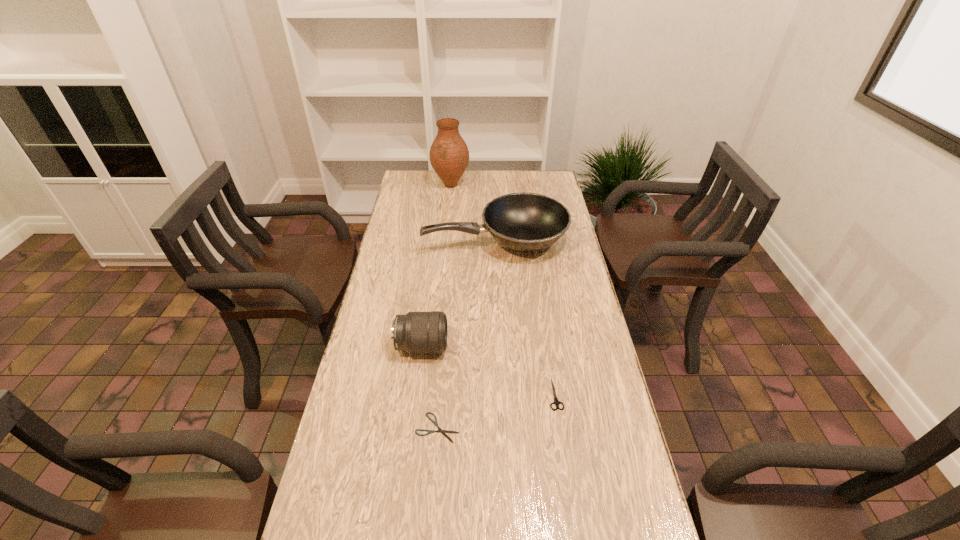
Where is `empty space that is in between the tallest object and the telephoto lens`? This screenshot has width=960, height=540. empty space that is in between the tallest object and the telephoto lens is located at coordinates (436, 266).

This screenshot has width=960, height=540. What are the coordinates of `free space between the frying pan and the shorter shears` in the screenshot? It's located at (467, 334).

Identify the location of free area in between the right shears and the fourth nearest object. (525, 318).

Where is `vacant point located between the fourth tallest object and the nearest object`? This screenshot has width=960, height=540. vacant point located between the fourth tallest object and the nearest object is located at coordinates (496, 411).

Locate an element on the screen. free point between the telephoto lens and the nearer shears is located at coordinates (430, 387).

Identify which object is the third nearest to the telephoto lens. Please provide its 2D coordinates. Your answer should be formatted as a tuple, i.e. [(x, y)], where the tuple contains the x and y coordinates of a point satisfying the conditions above.

[(526, 222)]

Choose which object is the second nearest neighbor to the second farthest object. Please provide its 2D coordinates. Your answer should be formatted as a tuple, i.e. [(x, y)], where the tuple contains the x and y coordinates of a point satisfying the conditions above.

[(416, 332)]

Locate an element on the screen. vacant space that satisfies the following two spatial constraints: 1. on the back side of the right shears; 2. on the surface of the third farthest object is located at coordinates (548, 346).

The image size is (960, 540). I want to click on vacant space that satisfies the following two spatial constraints: 1. on the surface of the third nearest object; 2. on the left side of the nearest object, so click(411, 428).

I want to click on free space that satisfies the following two spatial constraints: 1. on the surface of the telephoto lens; 2. on the back side of the shorter shears, so click(x=411, y=428).